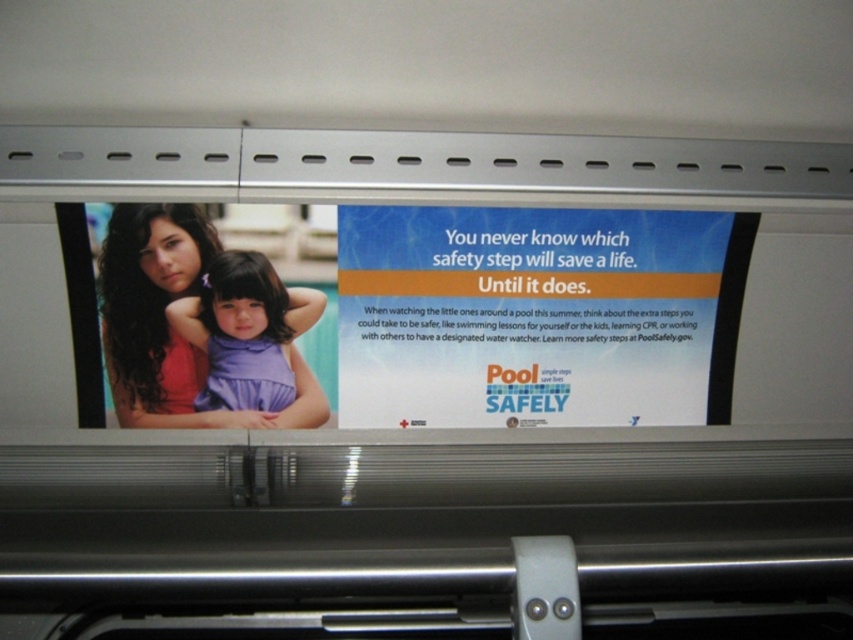
What do you see at coordinates (535, 316) in the screenshot? I see `white paper at center` at bounding box center [535, 316].

Between white paper at center and purple matte dress at center, which one has more height?

Standing taller between the two is white paper at center.

Is point (373, 209) less distant than point (264, 276)?

Yes, it is in front of point (264, 276).

Identify the location of white paper at center. Image resolution: width=853 pixels, height=640 pixels. (535, 316).